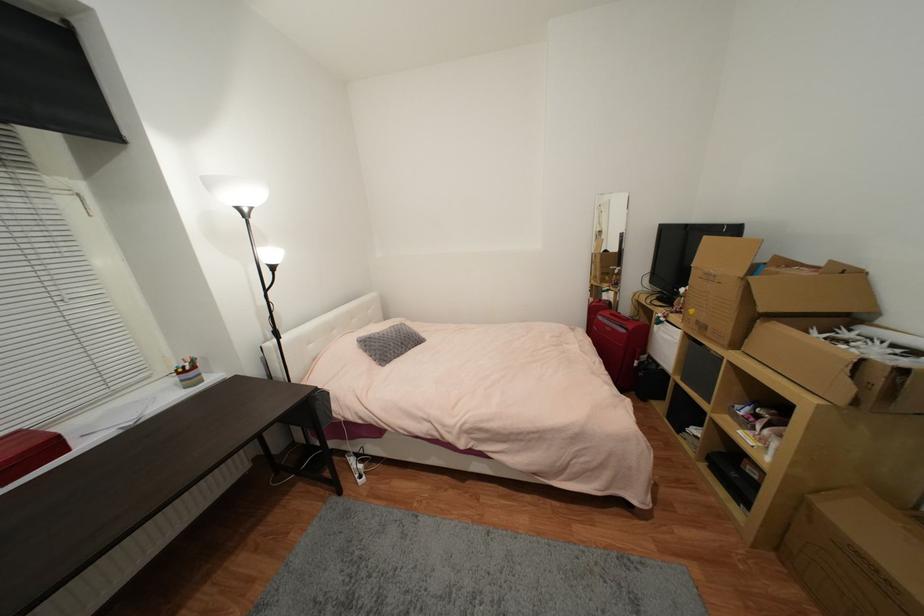
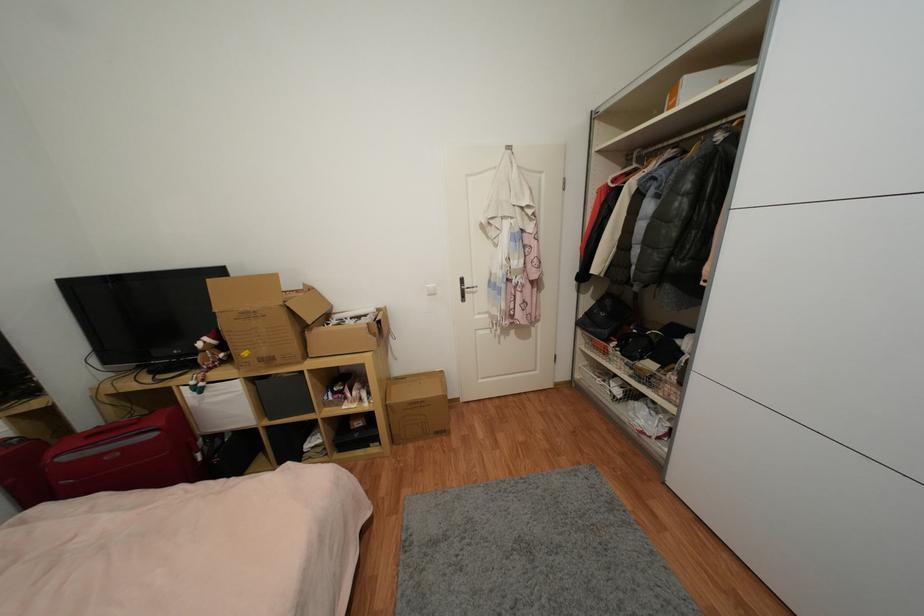
Find the pixel in the second image that matches point 627,331 in the first image.

(157, 436)